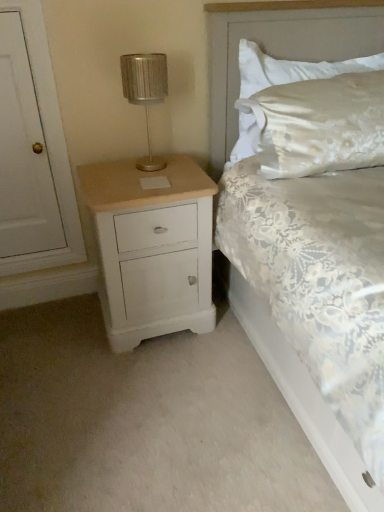
At what (x,y) coordinates should I click in order to perform the action: click on vacant space underneath metallic silver table lamp at upper left (from a real-world perspective). Please return your answer as a coordinate pair (x, y). Looking at the image, I should click on (152, 160).